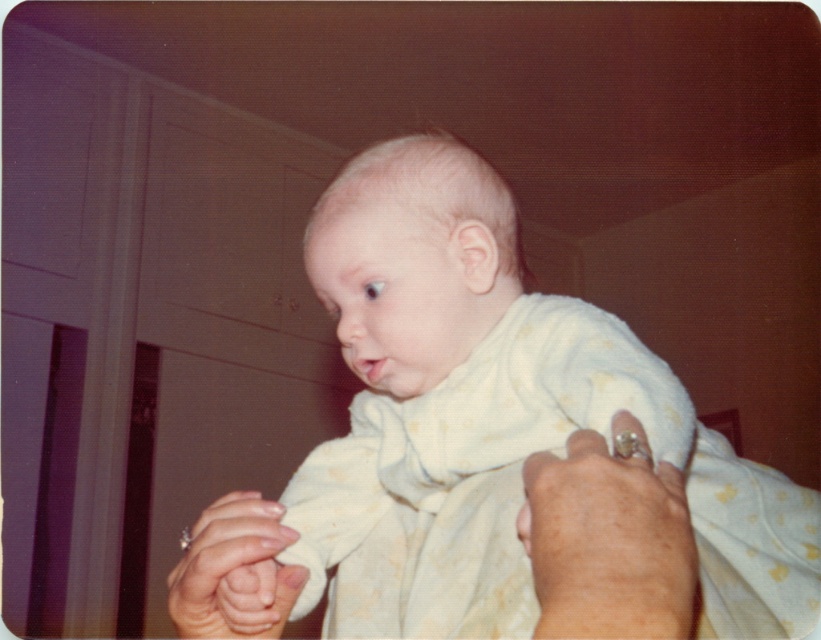
In the scene shown: You are a photographer in a room with wooden paneling. You need to place a white soft cloth at center to cover the baby in the image. According to the scene description, where exactly should you place the cloth relative to the baby?

The white soft cloth at center should be placed at point (487,426) relative to the baby to cover them appropriately.

You are a photographer adjusting your camera focus. You need to focus on two points in the image, point (425, 472) and point (544, 509). Which point should you focus on first to ensure the closest object is sharp?

Point (425, 472) is further to the camera than point (544, 509), so you should focus on point (425, 472) first to ensure the closest object is sharp.

You are a nurse checking the baby in the image. You need to clean the baby using the items available. The white soft cloth at center and the smooth skin hand at lower right are visible. Which item is larger in width to use for cleaning?

The white soft cloth at center might be wider than smooth skin hand at lower right, so it is possibly the better choice for cleaning due to its larger width.